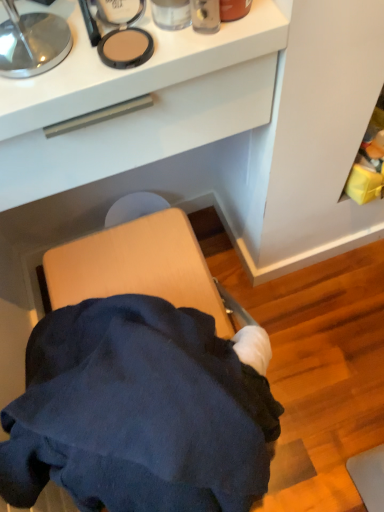
The image size is (384, 512). Find the location of `empty space that is ontop of white matte drawer at upper center (from a real-world perspective)`. empty space that is ontop of white matte drawer at upper center (from a real-world perspective) is located at coordinates (88, 34).